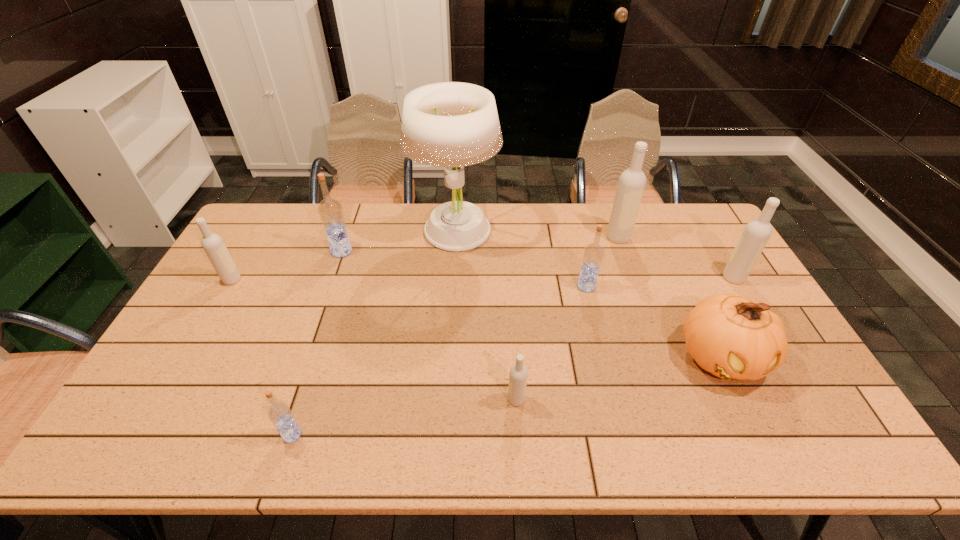
Where is `vacant space located on the left of the fourth object from right to left`? The width and height of the screenshot is (960, 540). vacant space located on the left of the fourth object from right to left is located at coordinates (453, 286).

The image size is (960, 540). I want to click on vacant position located 0.390m on the right of the leftmost vodka, so click(x=363, y=280).

Locate an element on the screen. The image size is (960, 540). free region located on the front face of the eighth object from left to right is located at coordinates (x=766, y=450).

Find the location of a particular element. vacant space located 0.060m on the right of the smallest white vodka is located at coordinates (548, 400).

Identify the location of free location located 0.200m on the right of the smallest blue vodka. (387, 435).

This screenshot has width=960, height=540. In order to click on lamp located at the far edge in this screenshot , I will do `click(450, 124)`.

Find the location of a particular element. object present at the near edge is located at coordinates (279, 412).

Find the location of a particular element. The height and width of the screenshot is (540, 960). object that is at the left edge is located at coordinates (213, 245).

Where is `vodka located at the right edge`? This screenshot has height=540, width=960. vodka located at the right edge is located at coordinates (757, 232).

Where is `pumpkin that is at the right edge`? This screenshot has width=960, height=540. pumpkin that is at the right edge is located at coordinates (732, 337).